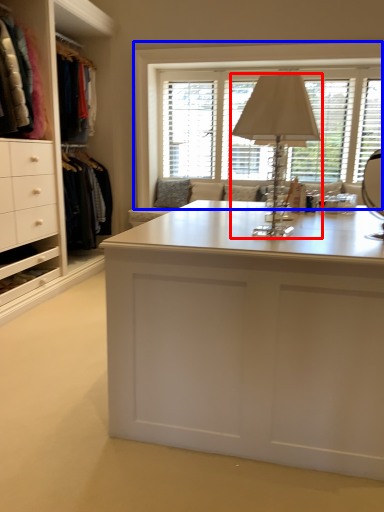
Question: Among these objects, which one is nearest to the camera, table lamp (highlighted by a red box) or window (highlighted by a blue box)?

Choices:
 (A) table lamp
 (B) window

Answer: (A)